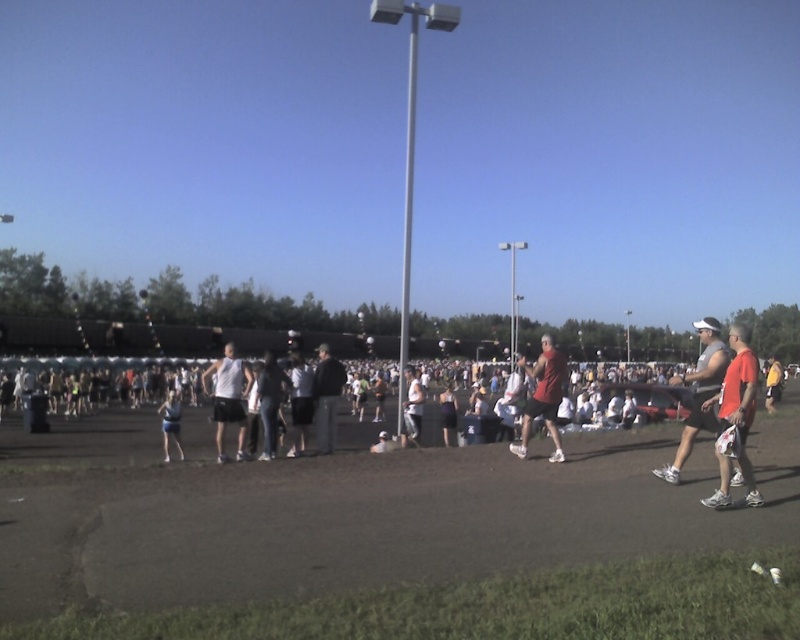
Question: Does red matte shirt at right have a larger size compared to yellow fabric shirt at right?

Choices:
 (A) no
 (B) yes

Answer: (A)

Question: Does white tank top at center have a greater width compared to light blue fabric shorts at center?

Choices:
 (A) yes
 (B) no

Answer: (B)

Question: Does red matte shirt at right appear on the right side of light blue fabric shorts at center?

Choices:
 (A) yes
 (B) no

Answer: (A)

Question: Estimate the real-world distances between objects in this image. Which object is closer to the red matte shirt at right?

Choices:
 (A) dark gray tank top at center
 (B) brown dirt track at center

Answer: (B)

Question: Which object is positioned farthest from the brown dirt track at center?

Choices:
 (A) matte red shirt at right
 (B) matte red shirt at center
 (C) yellow fabric shirt at right

Answer: (C)

Question: Which point is closer to the camera?

Choices:
 (A) (776, 400)
 (B) (48, 540)
 (C) (340, 371)

Answer: (B)